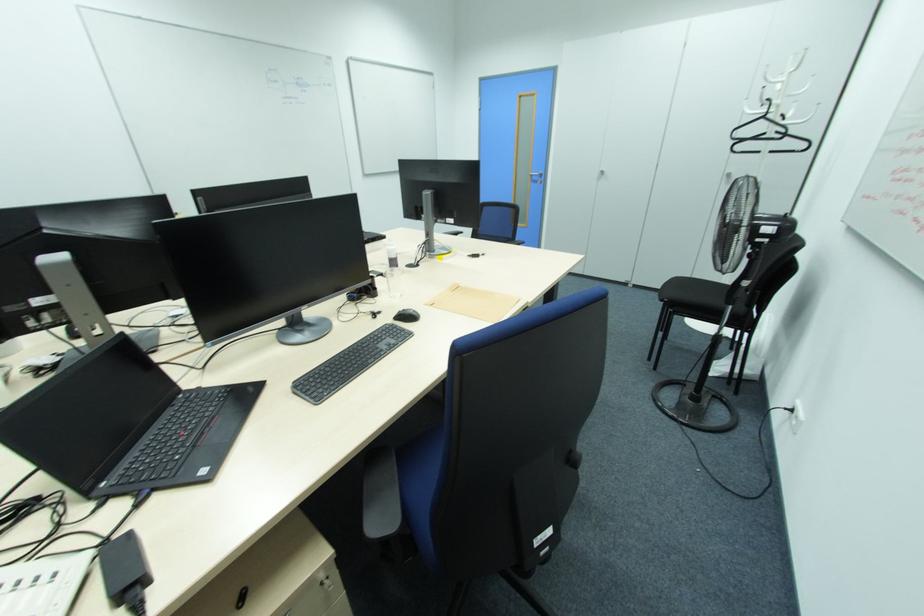
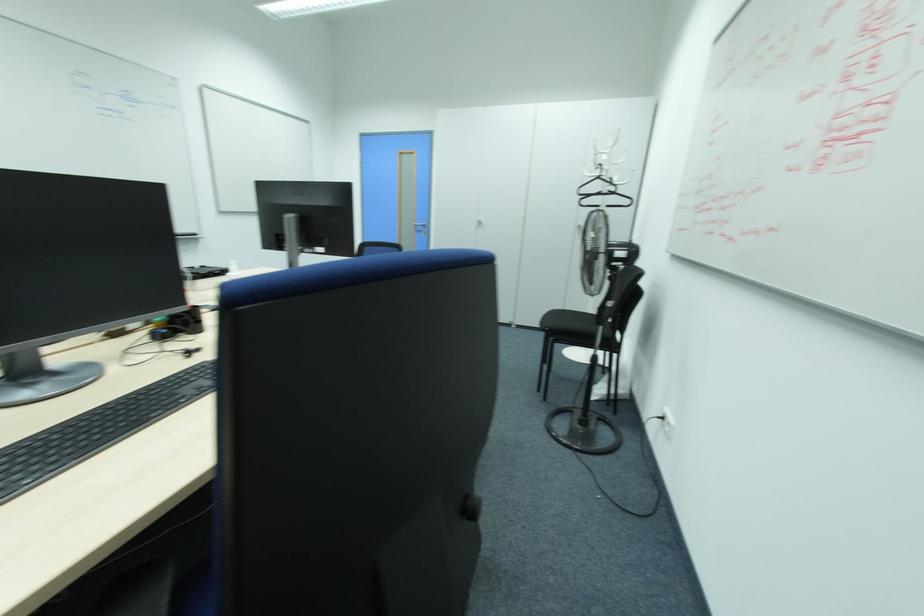
Question: The camera is either moving clockwise (left) or counter-clockwise (right) around the object. The first image is from the beginning of the video and the second image is from the end. Is the camera moving left or right when shooting the video?

Choices:
 (A) Left
 (B) Right

Answer: (A)